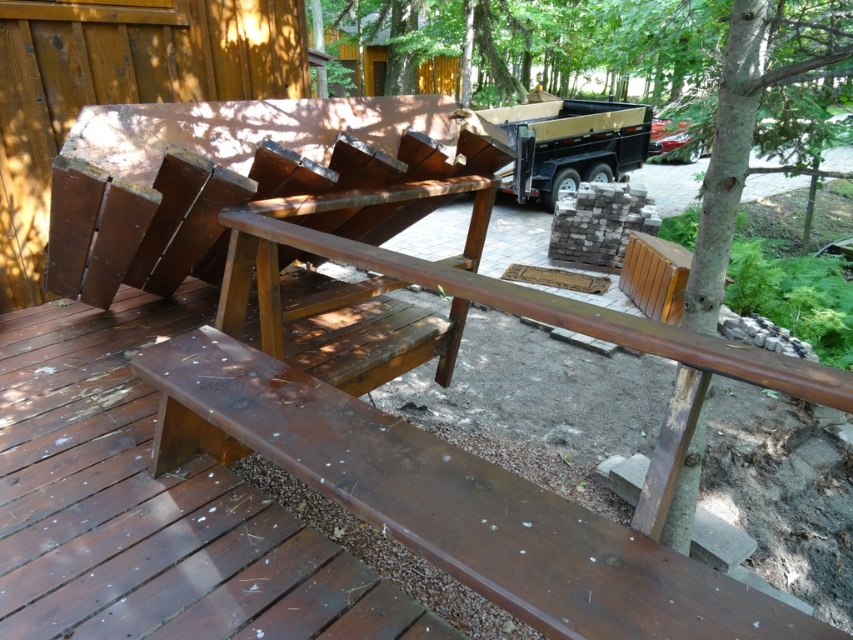
You are planning to place a new potted plant on the deck. The potted plant requires shade to prevent it from drying out. Given the current setup with the matte brown bench at lower center and the brown wood tree at upper center, where should you place the potted plant to ensure it stays in the shade?

You should place the potted plant under the matte brown bench at lower center since it is positioned under the brown wood tree at upper center, which likely provides shade over that area.

You are standing at the edge of the deck and want to place a 36 inch long tool box on the ground near the matte brown bench at lower center. Can the tool box fit in front of the bench without overlapping it?

The matte brown bench at lower center is 36.95 inches away from the viewer. Since the tool box is 36 inches long, it can fit in front of the bench as the distance is sufficient.

You are standing on the wooden deck and want to move towards the brown wood tree at upper center. Which direction should you walk relative to the matte brown bench at lower center?

You should walk to the right of the matte brown bench at lower center to reach the brown wood tree at upper center because the bench is positioned to the left of the tree.